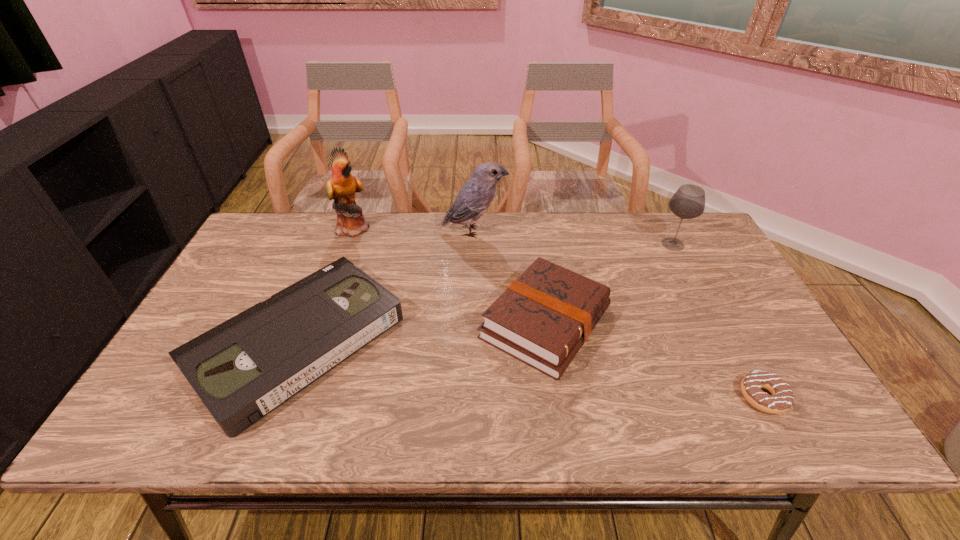
Where is `free space that satisfies the following two spatial constraints: 1. on the front-facing side of the right parrot; 2. on the back side of the hardback book`? The image size is (960, 540). free space that satisfies the following two spatial constraints: 1. on the front-facing side of the right parrot; 2. on the back side of the hardback book is located at coordinates (472, 322).

Image resolution: width=960 pixels, height=540 pixels. I want to click on vacant space that satisfies the following two spatial constraints: 1. on the front-facing side of the right parrot; 2. on the left side of the fourth tallest object, so click(x=472, y=322).